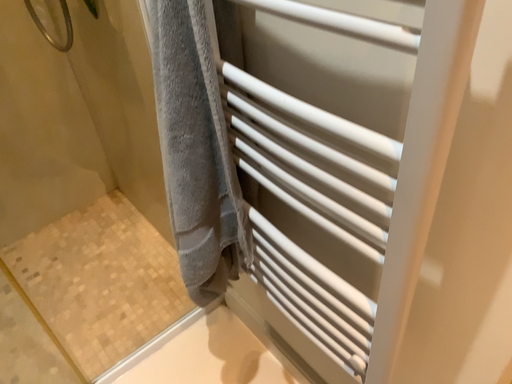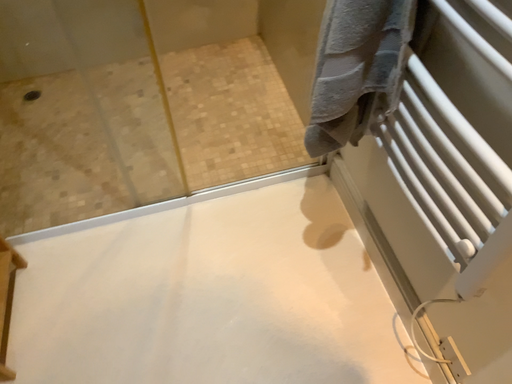
Question: Which way did the camera rotate in the video?

Choices:
 (A) rotated left
 (B) rotated right

Answer: (A)